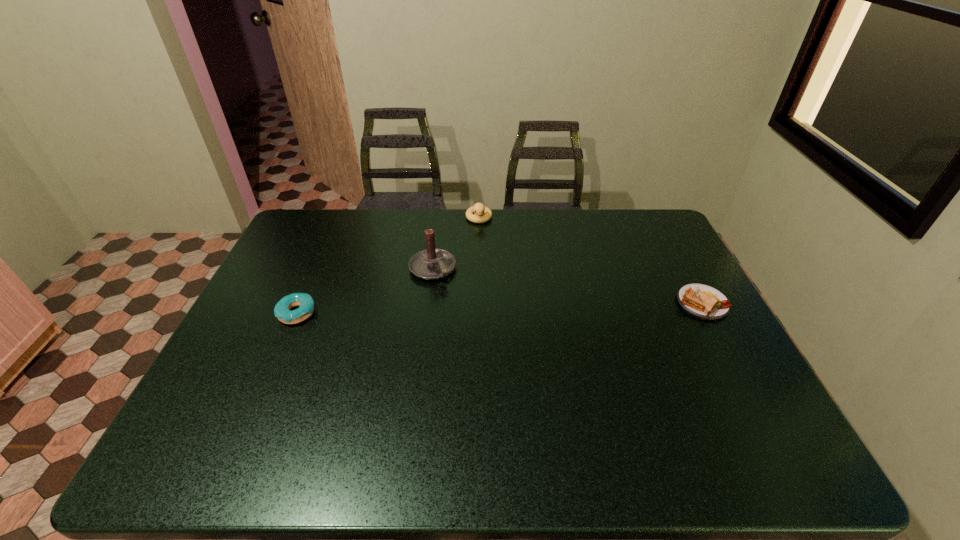
The image size is (960, 540). I want to click on free space at the far left corner, so click(297, 221).

Locate an element on the screen. Image resolution: width=960 pixels, height=540 pixels. free space at the far right corner of the desktop is located at coordinates (642, 233).

What are the coordinates of `free space at the near right corner of the desktop` in the screenshot? It's located at (703, 413).

At what (x,y) coordinates should I click in order to perform the action: click on empty location between the leftmost object and the second tallest object. Please return your answer as a coordinate pair (x, y). This screenshot has height=540, width=960. Looking at the image, I should click on (388, 266).

Locate an element on the screen. vacant region between the third nearest object and the leftmost object is located at coordinates (365, 291).

This screenshot has width=960, height=540. I want to click on vacant area between the sandwich and the third nearest object, so click(x=567, y=286).

Where is `vacant space that's between the duckling and the leftmost object`? vacant space that's between the duckling and the leftmost object is located at coordinates (388, 266).

The width and height of the screenshot is (960, 540). Identify the location of unoccupied area between the sandwich and the doughnut. (499, 308).

The width and height of the screenshot is (960, 540). What are the coordinates of `empty space between the sandwich and the third nearest object` in the screenshot? It's located at (567, 286).

Locate an element on the screen. Image resolution: width=960 pixels, height=540 pixels. empty space that is in between the doughnut and the tallest object is located at coordinates (365, 291).